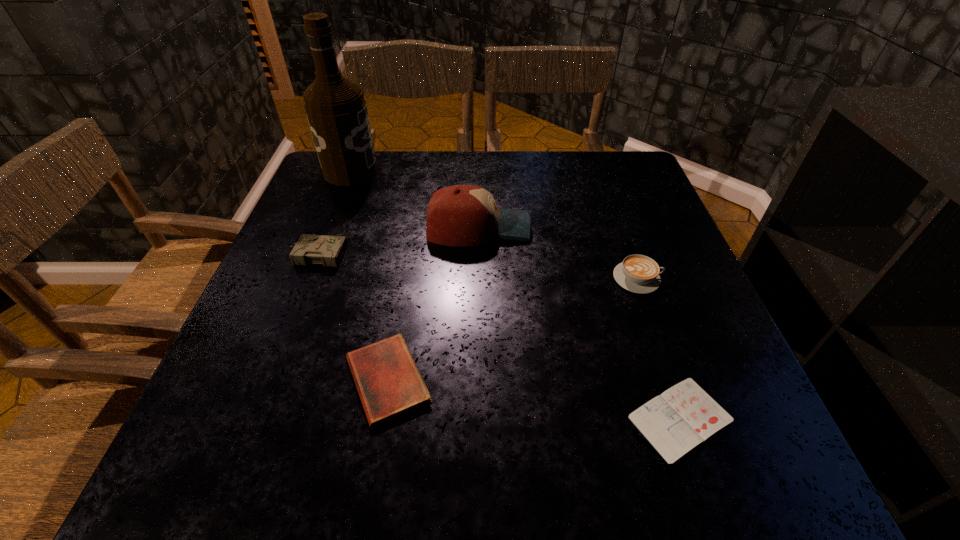
Where is `diary that is at the right edge`? diary that is at the right edge is located at coordinates (682, 417).

At what (x,y) coordinates should I click in order to perform the action: click on object present at the far left corner. Please return your answer as a coordinate pair (x, y). This screenshot has height=540, width=960. Looking at the image, I should click on (336, 110).

The image size is (960, 540). Identify the location of object at the near right corner. (682, 417).

Identify the location of free space at the far edge of the desktop. The image size is (960, 540). (392, 191).

The image size is (960, 540). In the image, there is a desktop. Find the location of `vacant space at the left edge`. vacant space at the left edge is located at coordinates (239, 363).

Image resolution: width=960 pixels, height=540 pixels. I want to click on vacant space at the right edge, so click(x=695, y=282).

Where is `free space at the far left corner of the desktop`? This screenshot has height=540, width=960. free space at the far left corner of the desktop is located at coordinates (339, 192).

In the image, there is a desktop. Identify the location of blank space at the near left corner. The image size is (960, 540). (287, 440).

You are a GUI agent. You are given a task and a screenshot of the screen. Output one action in this format:
    pyautogui.click(x=<x>, y=<y>)
    Task: Click on the vacant space at the far right corner of the desktop
    Image resolution: width=960 pixels, height=540 pixels.
    Given the screenshot: What is the action you would take?
    pyautogui.click(x=609, y=157)

Find the location of a particular element. This screenshot has height=540, width=960. free space between the cappuccino and the second shortest diary is located at coordinates (513, 329).